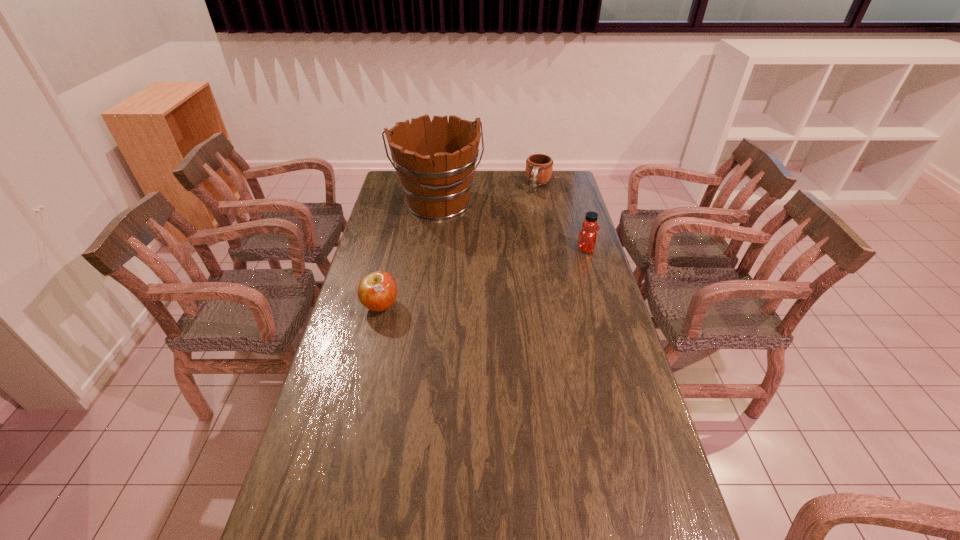
Image resolution: width=960 pixels, height=540 pixels. I want to click on vacant space that satisfies the following two spatial constraints: 1. on the back side of the apple; 2. on the front label of the rightmost object, so [395, 249].